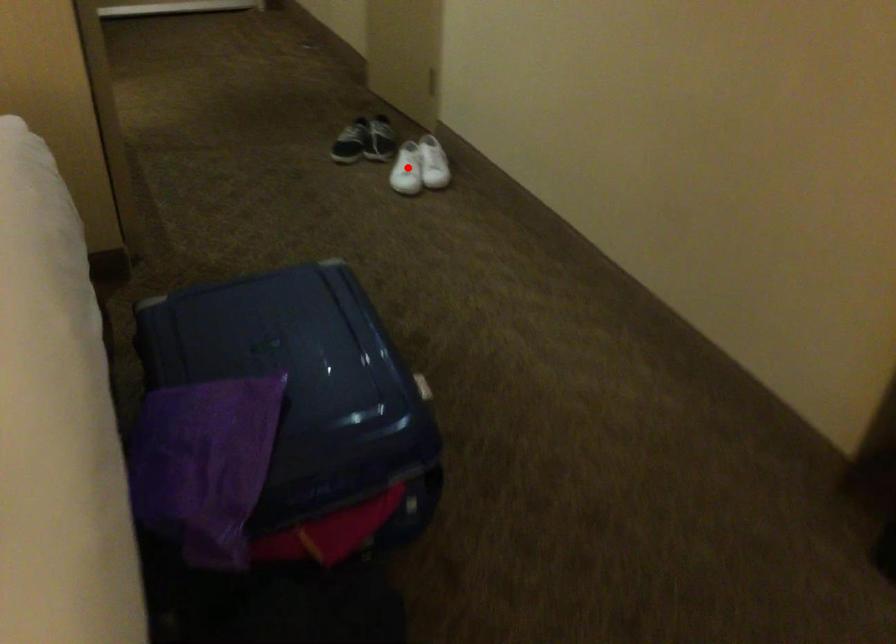
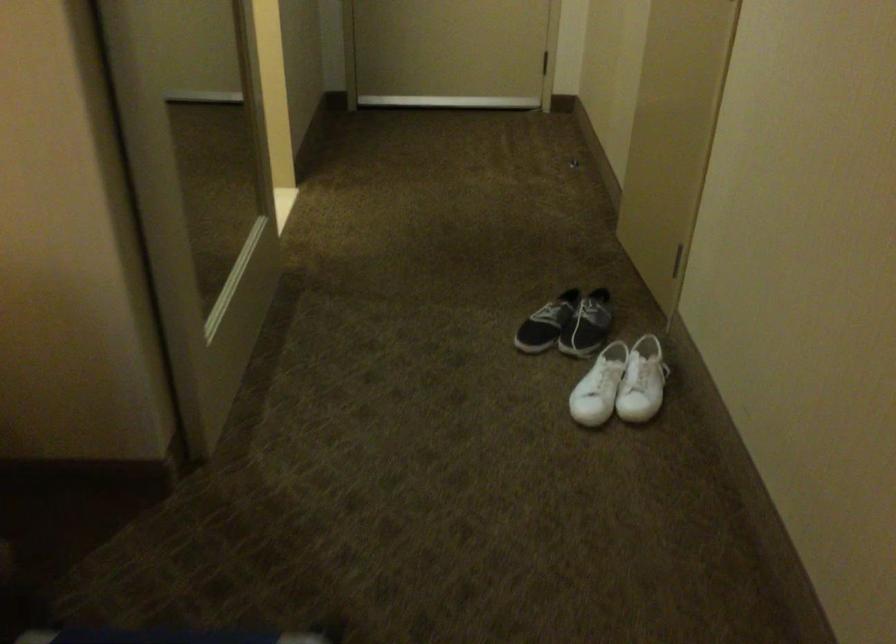
Locate, in the second image, the point that corresponds to the highlighted location in the first image.

(599, 386)